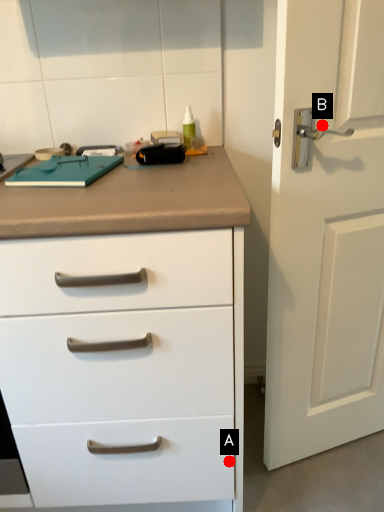
Question: Two points are circled on the image, labeled by A and B beside each circle. Which point appears farthest from the camera in this image?

Choices:
 (A) A is further
 (B) B is further

Answer: (A)